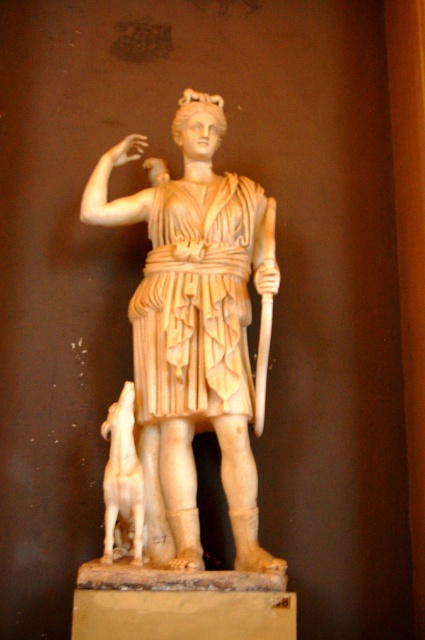
Describe the element at coordinates (192, 330) in the screenshot. I see `white marble statue at center` at that location.

Which is in front, point (144, 365) or point (116, 534)?

Point (116, 534)

Locate an element on the screen. The width and height of the screenshot is (425, 640). white marble statue at center is located at coordinates (192, 330).